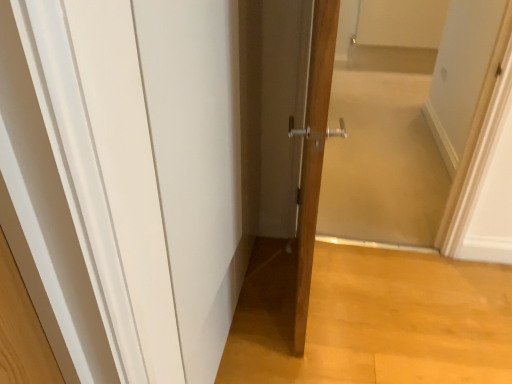
Question: From the image's perspective, is transparent glass door at center positioned above or below wooden door at center?

Choices:
 (A) above
 (B) below

Answer: (A)

Question: Is point (378, 153) closer or farther from the camera than point (327, 134)?

Choices:
 (A) closer
 (B) farther

Answer: (B)

Question: Considering their positions, is transparent glass door at center located in front of or behind wooden door at center?

Choices:
 (A) front
 (B) behind

Answer: (B)

Question: Is wooden door at center to the left or to the right of transparent glass door at center in the image?

Choices:
 (A) right
 (B) left

Answer: (B)

Question: From a real-world perspective, relative to transparent glass door at center, is wooden door at center vertically above or below?

Choices:
 (A) below
 (B) above

Answer: (B)

Question: Relative to transparent glass door at center, is wooden door at center in front or behind?

Choices:
 (A) front
 (B) behind

Answer: (A)

Question: In terms of height, does wooden door at center look taller or shorter compared to transparent glass door at center?

Choices:
 (A) short
 (B) tall

Answer: (B)